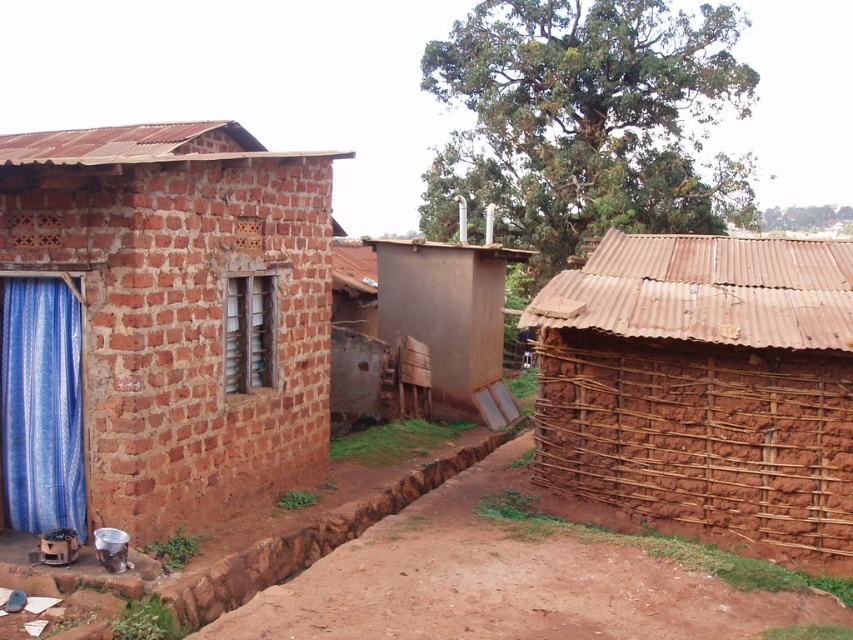
Question: Among these objects, which one is nearest to the camera?

Choices:
 (A) brown brick house at left
 (B) blue woven curtain at left

Answer: (A)

Question: Among these objects, which one is nearest to the camera?

Choices:
 (A) brown brick house at left
 (B) brown mud hut at right

Answer: (A)

Question: Among these points, which one is nearest to the camera?

Choices:
 (A) (50, 298)
 (B) (613, 376)

Answer: (A)

Question: Is brown brick house at left to the left of brown mud hut at right from the viewer's perspective?

Choices:
 (A) no
 (B) yes

Answer: (B)

Question: Is brown mud hut at right above blue woven curtain at left?

Choices:
 (A) no
 (B) yes

Answer: (B)

Question: Can you confirm if brown brick house at left is wider than brown mud hut at right?

Choices:
 (A) no
 (B) yes

Answer: (B)